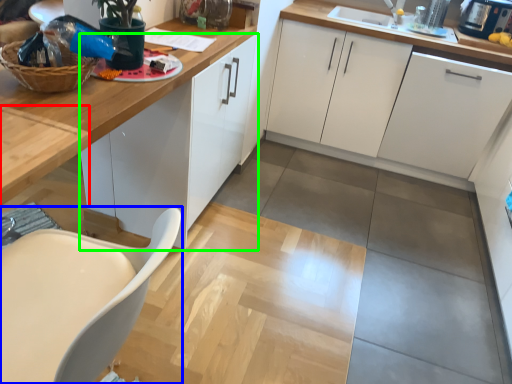
Question: Estimate the real-world distances between objects in this image. Which object is closer to table (highlighted by a red box), chair (highlighted by a blue box) or cabinetry (highlighted by a green box)?

Choices:
 (A) chair
 (B) cabinetry

Answer: (A)